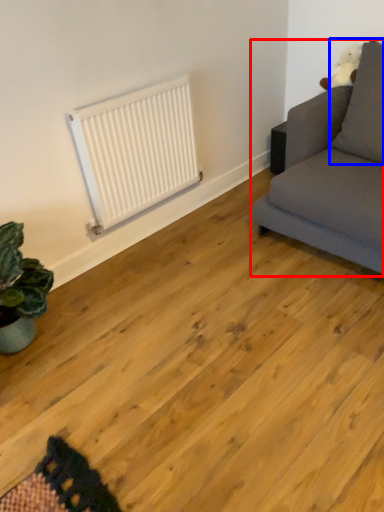
Question: Which object appears closest to the camera in this image, studio couch (highlighted by a red box) or pillow (highlighted by a blue box)?

Choices:
 (A) studio couch
 (B) pillow

Answer: (A)